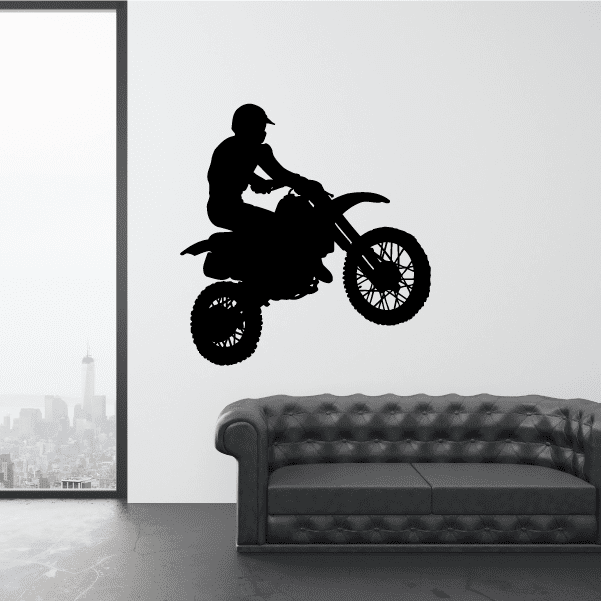
Where is `white wall`? white wall is located at coordinates (468, 100).